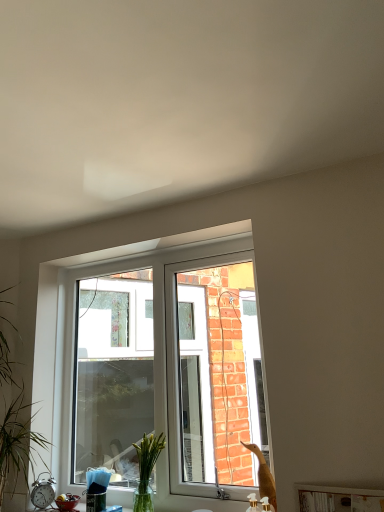
Question: Considering the positions of point [251, 279] and point [44, 496], is point [251, 279] closer or farther from the camera than point [44, 496]?

Choices:
 (A) farther
 (B) closer

Answer: (A)

Question: Considering the positions of white plastic window at center and silver metallic alarm clock at lower left in the image, is white plastic window at center bigger or smaller than silver metallic alarm clock at lower left?

Choices:
 (A) big
 (B) small

Answer: (A)

Question: Based on their relative distances, which object is farther from the white glossy wood at lower center?

Choices:
 (A) silver metallic alarm clock at lower left
 (B) clear glass vase at center
 (C) white plastic window at center
 (D) green leafy plant at left

Answer: (D)

Question: Which is nearer to the green leafy plant at left?

Choices:
 (A) silver metallic alarm clock at lower left
 (B) white glossy wood at lower center
 (C) clear glass vase at center
 (D) white plastic window at center

Answer: (A)